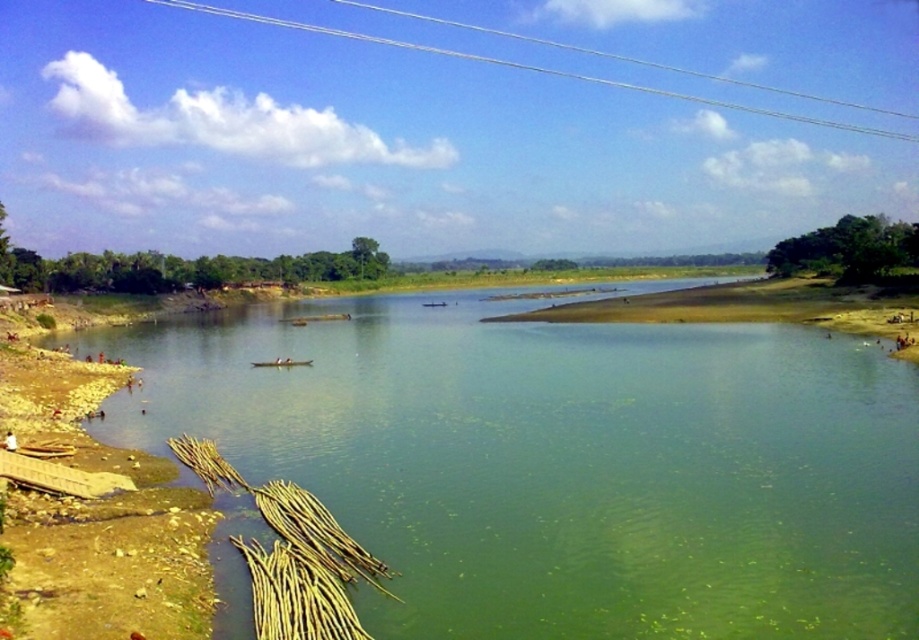
Question: Can you confirm if green algae-covered water at center is bigger than brown rough reed at lower left?

Choices:
 (A) yes
 (B) no

Answer: (A)

Question: Which object appears farthest from the camera in this image?

Choices:
 (A) green algae-covered water at center
 (B) brown rough reed at lower left

Answer: (A)

Question: Which point is closer to the camera?

Choices:
 (A) (515, 573)
 (B) (323, 592)

Answer: (B)

Question: Can you confirm if green algae-covered water at center is positioned above brown rough reed at lower left?

Choices:
 (A) yes
 (B) no

Answer: (A)

Question: Does green algae-covered water at center appear over brown rough reed at lower left?

Choices:
 (A) no
 (B) yes

Answer: (B)

Question: Which point is closer to the camera?

Choices:
 (A) brown rough reed at lower left
 (B) green algae-covered water at center

Answer: (A)